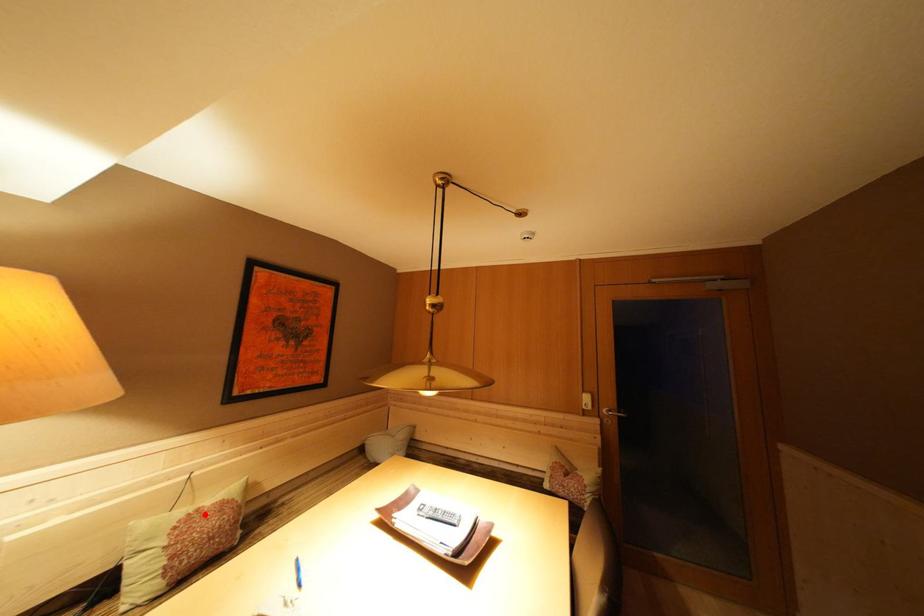
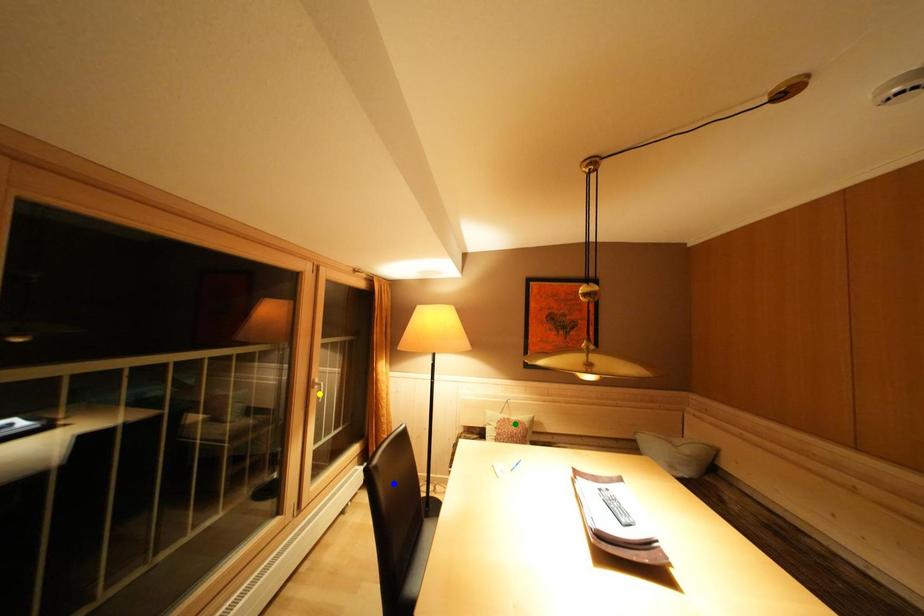
Question: I am providing you with two images of the same scene from different viewpoints. A red point is marked on the first image. You are given multiple points on the second image. In image 2, which mark is for the same physical point as the one in image 1?

Choices:
 (A) blue point
 (B) green point
 (C) yellow point

Answer: (B)